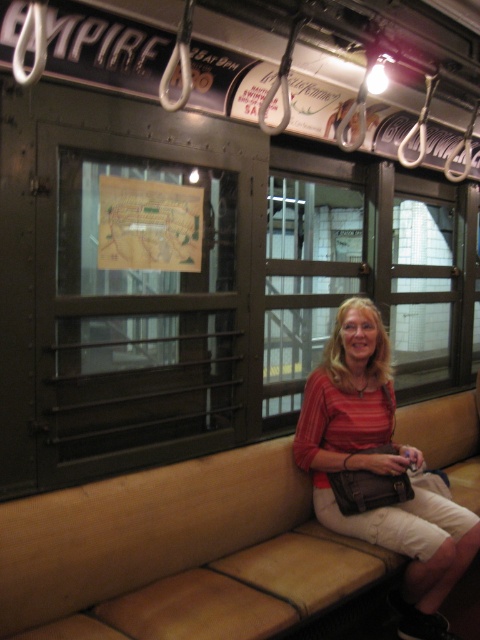
Can you confirm if beige leather couch at center is taller than matte red blouse at center?

Incorrect, beige leather couch at center's height is not larger of matte red blouse at center's.

Is beige leather couch at center positioned before matte red blouse at center?

Yes, it is.

Between point (180, 513) and point (372, 317), which one is positioned behind?

The point (372, 317) is more distant.

Where is `beige leather couch at center`? Image resolution: width=480 pixels, height=640 pixels. beige leather couch at center is located at coordinates [x=178, y=554].